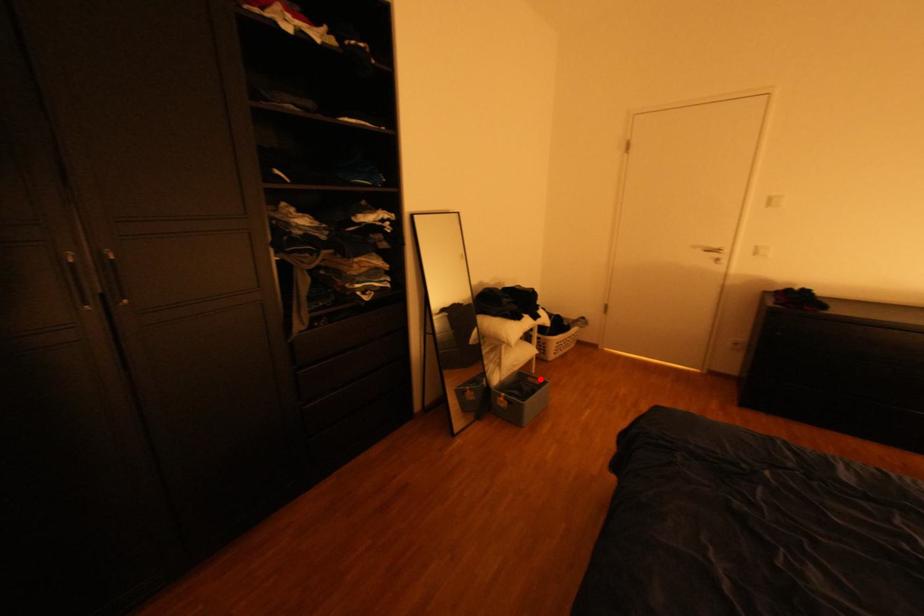
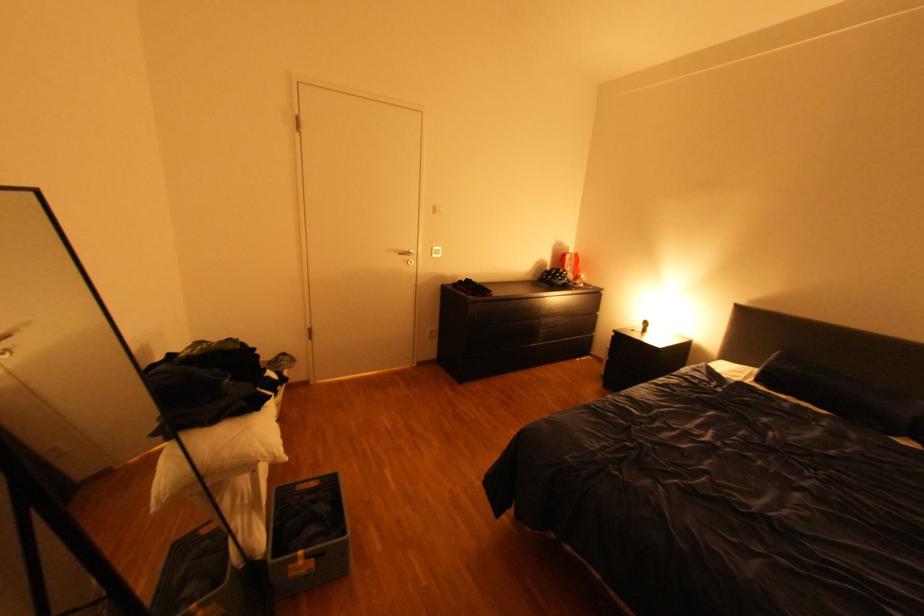
Question: I am providing you with two images of the same scene from different viewpoints. Given a red point in image1, look at the same physical point in image2. Is it:

Choices:
 (A) Closer to the viewpoint
 (B) Farther from the viewpoint

Answer: (B)